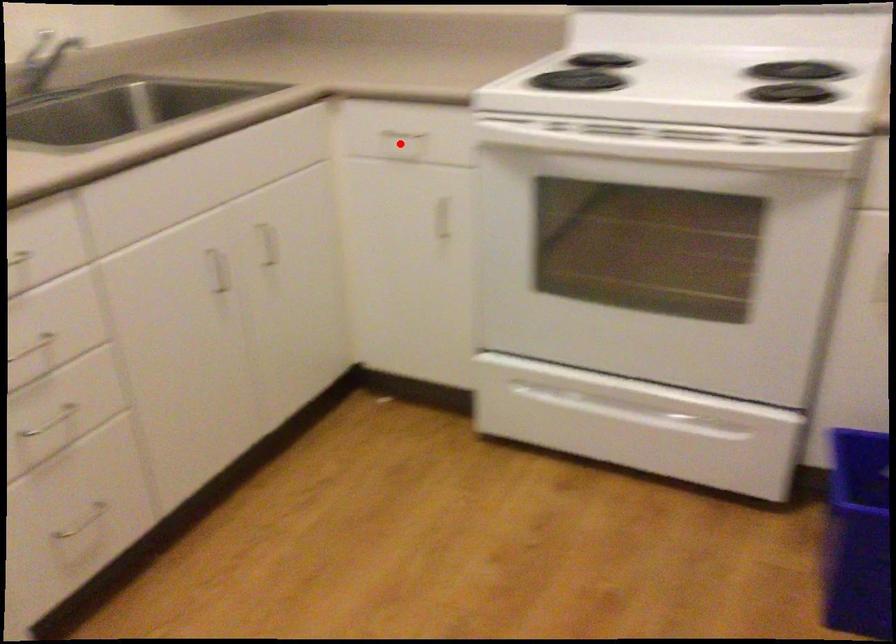
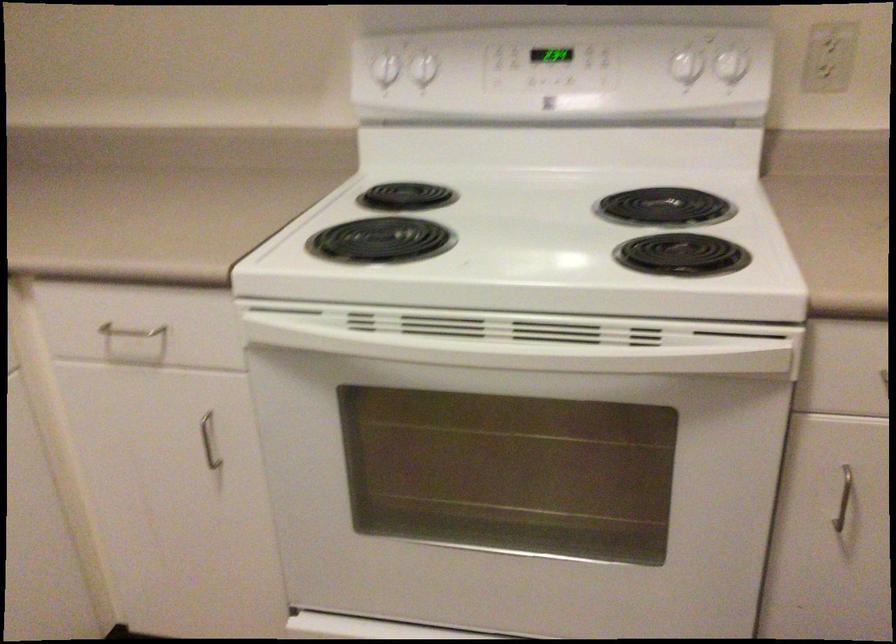
Locate, in the second image, the point that corresponds to the highlighted location in the first image.

(136, 337)